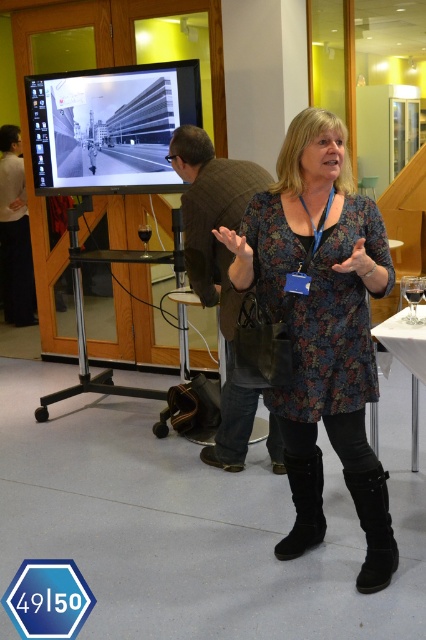
Which is more to the right, floral print dress at center or matte black laptop at left?

From the viewer's perspective, floral print dress at center appears more on the right side.

Does floral print dress at center appear over matte black laptop at left?

No, floral print dress at center is not above matte black laptop at left.

Is point (279, 241) farther from camera compared to point (13, 134)?

No, (279, 241) is in front of (13, 134).

Locate an element on the screen. Image resolution: width=426 pixels, height=640 pixels. floral print dress at center is located at coordinates (322, 326).

Does matte black laptop at left have a larger size compared to black suede boot at center?

Yes, matte black laptop at left is bigger than black suede boot at center.

Which is below, matte black laptop at left or black suede boot at center?

Positioned lower is black suede boot at center.

Which is in front, point (34, 308) or point (376, 509)?

Positioned in front is point (376, 509).

Where is `matte black laptop at left`? The image size is (426, 640). matte black laptop at left is located at coordinates (14, 234).

Is black suede boot at center further to camera compared to black suede boot at lower center?

No.

Measure the distance between point (370, 512) and camera.

A distance of 7.39 feet exists between point (370, 512) and camera.

Where is `black suede boot at center`? black suede boot at center is located at coordinates (374, 528).